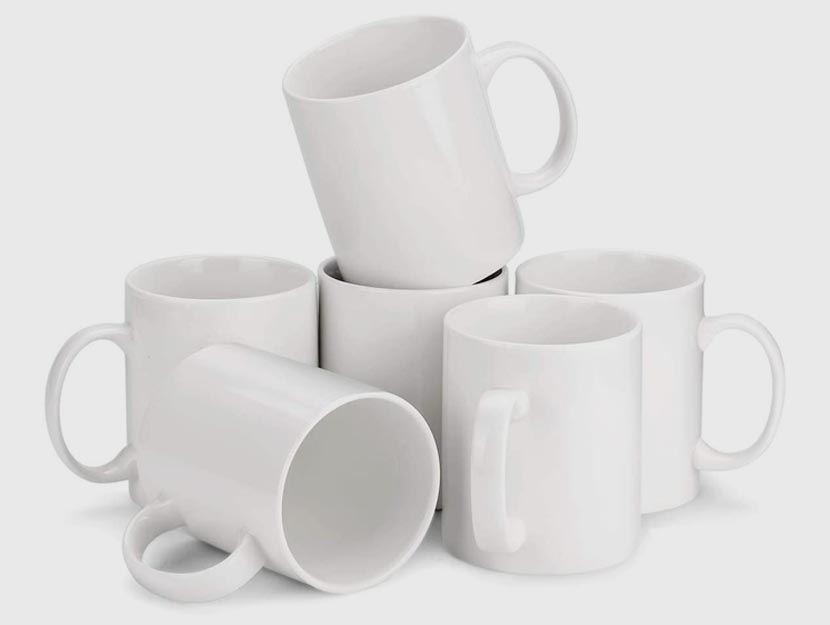
Identify the location of coffee cup handles. (61, 372), (227, 568), (491, 448), (778, 356), (569, 102).